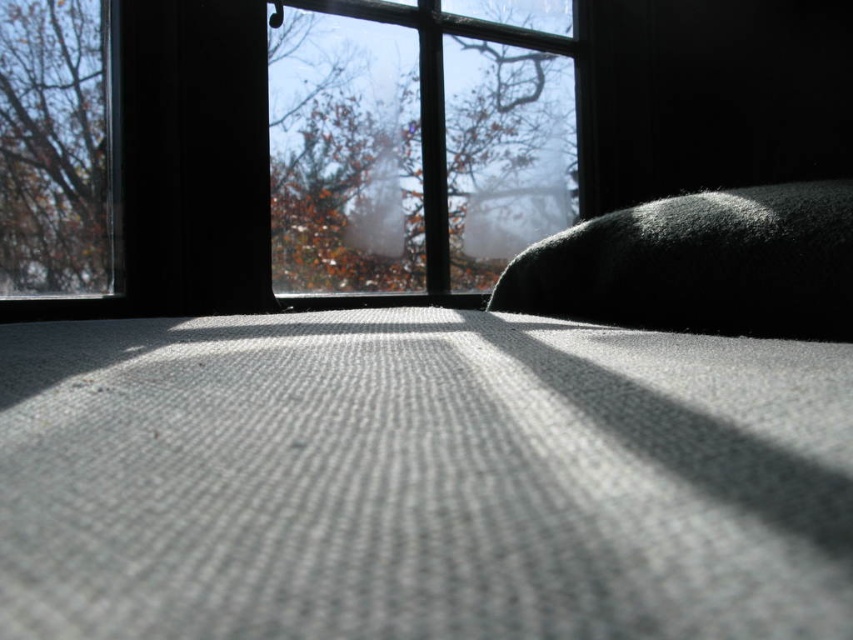
Question: Does transparent glass window at upper center have a lesser width compared to brown leafy tree at upper left?

Choices:
 (A) no
 (B) yes

Answer: (A)

Question: Can you confirm if transparent glass window at upper center is positioned to the right of black fuzzy pillow at right?

Choices:
 (A) no
 (B) yes

Answer: (A)

Question: Which point is farther to the camera?

Choices:
 (A) transparent glass window at upper center
 (B) brown leafy tree at upper left

Answer: (B)

Question: Which point is closer to the camera?

Choices:
 (A) black fuzzy pillow at right
 (B) brown leafy tree at upper left

Answer: (A)

Question: Is the position of transparent glass window at upper center more distant than that of brown leafy tree at upper left?

Choices:
 (A) yes
 (B) no

Answer: (B)

Question: Which point is farther to the camera?

Choices:
 (A) transparent glass window at upper center
 (B) brown leafy tree at upper left

Answer: (B)